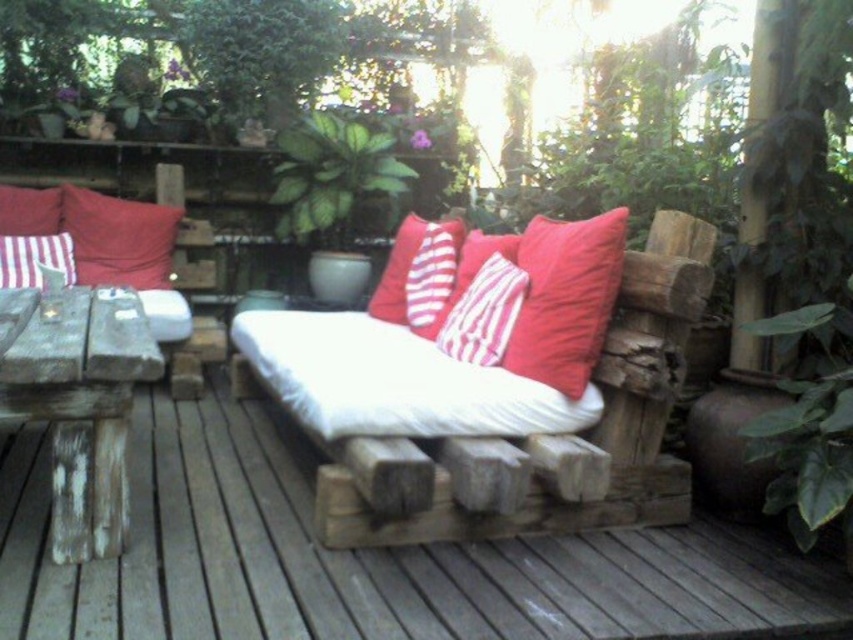
You are planning to place a small potted plant between the weathered wood table at left and the striped cotton pillow at center. Based on their positions, which object should the plant be closer to?

The plant should be placed closer to the weathered wood table at left since it is positioned to the left of the striped cotton pillow at center.

Looking at this image, you are sitting on the weathered wood deck at center and want to place your drink on the matte red pillow at upper left. Can you reach it without moving from your seat?

The weathered wood deck at center is to the right of the matte red pillow at upper left, so you can reach the matte red pillow at upper left by extending your arm to the left side from your seated position on the weathered wood deck at center.